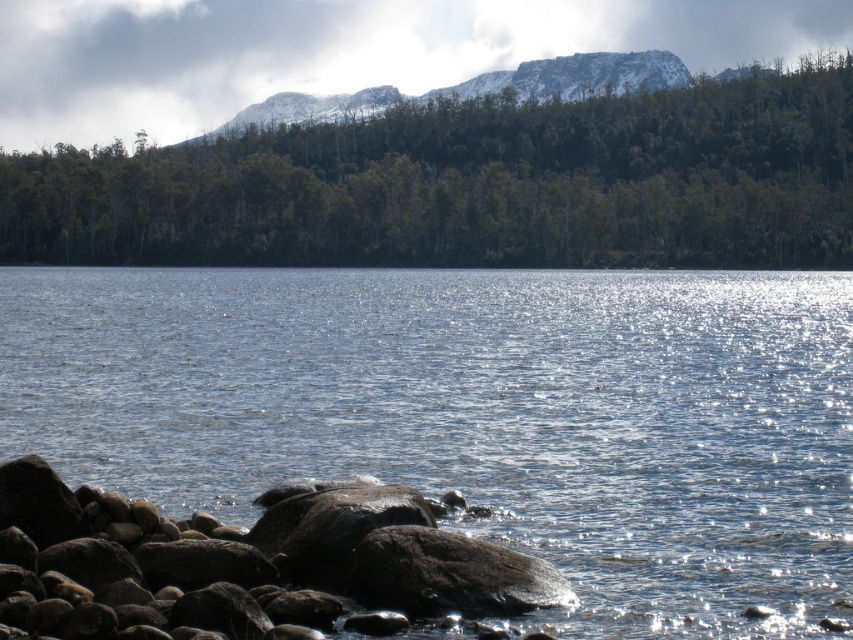
Between point (514, 484) and point (537, 136), which one is positioned behind?

The point (537, 136) is behind.

Is point (744, 440) farther from viewer compared to point (56, 182)?

No, it is not.

The height and width of the screenshot is (640, 853). I want to click on glistening blue water at center, so coord(477,416).